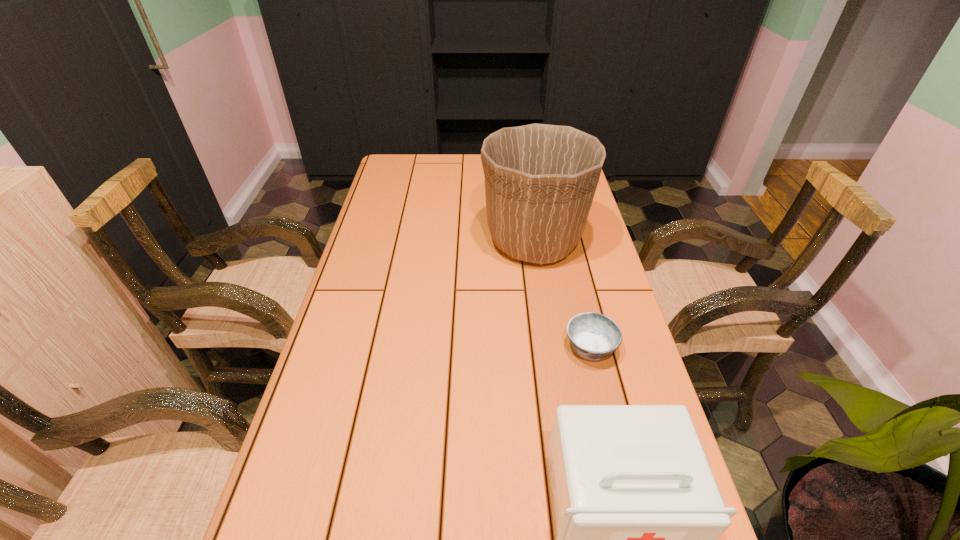
At what (x,y) coordinates should I click in order to perform the action: click on the farthest object. Please return your answer as a coordinate pair (x, y). Image resolution: width=960 pixels, height=540 pixels. Looking at the image, I should click on (540, 180).

Where is `flowerpot`? This screenshot has height=540, width=960. flowerpot is located at coordinates (540, 180).

Locate an element on the screen. The width and height of the screenshot is (960, 540). ashtray is located at coordinates (594, 336).

Locate an element on the screen. the shortest object is located at coordinates (594, 336).

Where is `vacant space located on the back of the tallest object`? The image size is (960, 540). vacant space located on the back of the tallest object is located at coordinates (526, 189).

Image resolution: width=960 pixels, height=540 pixels. What are the coordinates of `vacant space located 0.240m on the back of the second farthest object` in the screenshot? It's located at (571, 266).

Find the location of a particular element. flowerpot at the right edge is located at coordinates (540, 180).

Image resolution: width=960 pixels, height=540 pixels. What are the coordinates of `ashtray that is at the right edge` in the screenshot? It's located at (594, 336).

This screenshot has height=540, width=960. Identify the location of vacant area at the far edge of the desktop. (479, 158).

Where is `vacant space at the left edge`? The image size is (960, 540). vacant space at the left edge is located at coordinates (374, 222).